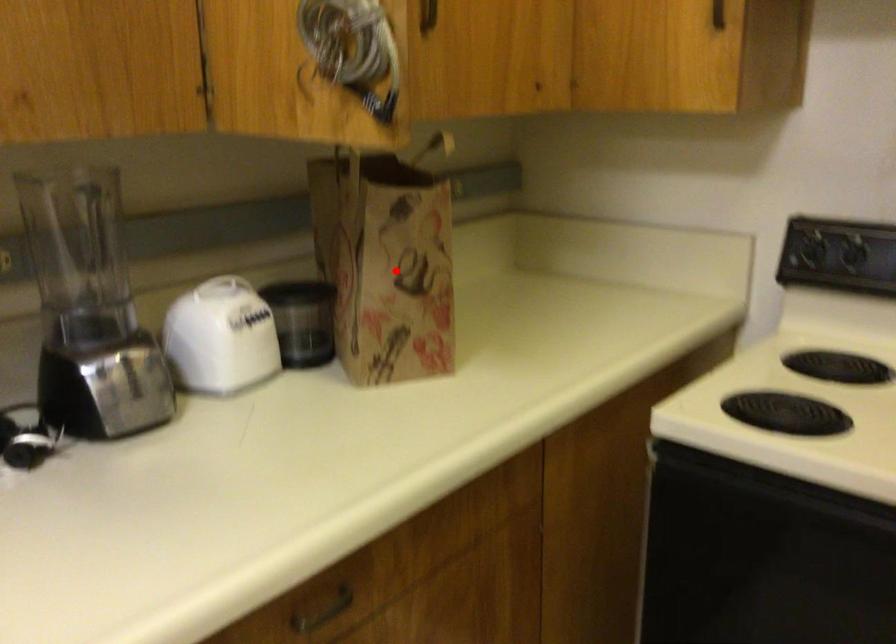
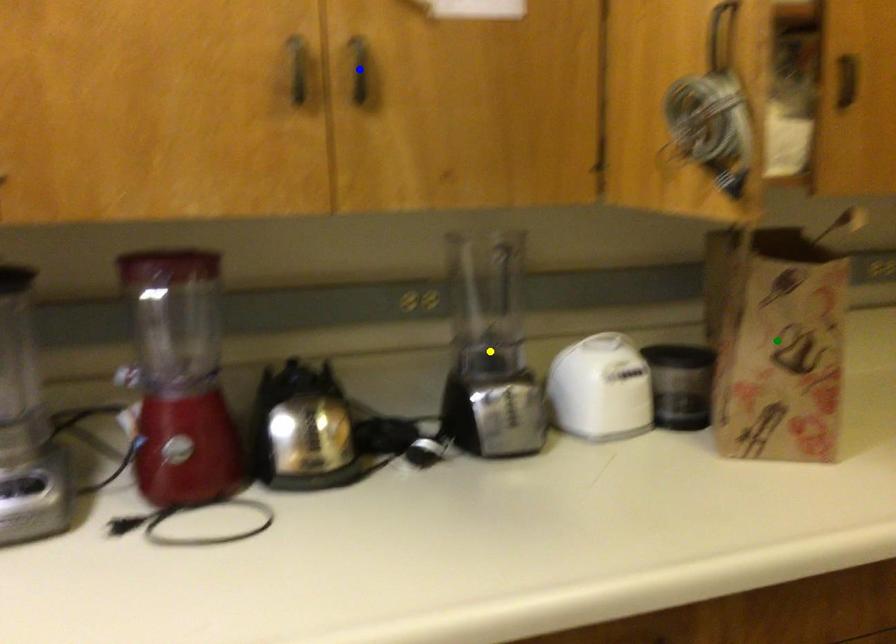
Question: I am providing you with two images of the same scene from different viewpoints. A red point is marked on the first image. You are given multiple points on the second image. Which point in image 2 is actually the same real-world point as the red point in image 1?

Choices:
 (A) blue point
 (B) yellow point
 (C) green point

Answer: (C)